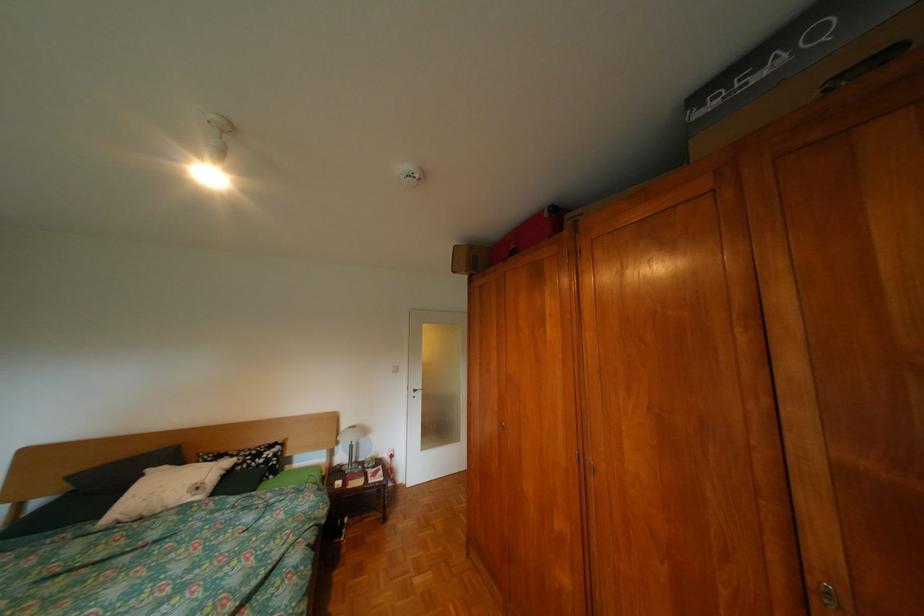
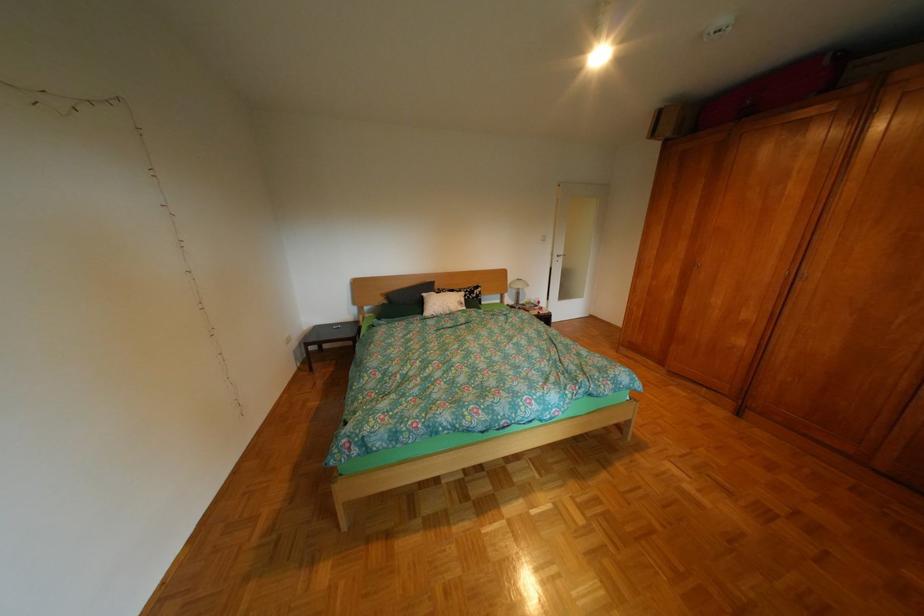
Find the pixel in the second image that matches (x=561, y=215) in the first image.

(842, 63)